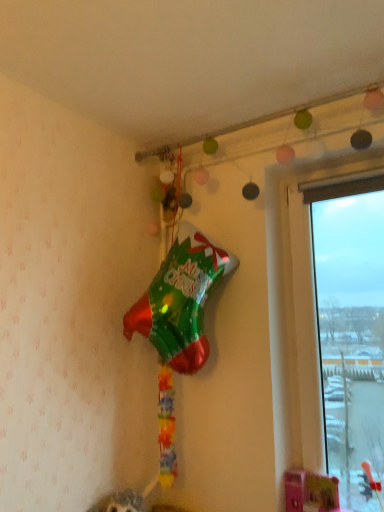
What do you see at coordinates (341, 330) in the screenshot? I see `transparent glass window at right` at bounding box center [341, 330].

The height and width of the screenshot is (512, 384). I want to click on transparent glass window at right, so click(341, 330).

In order to face transparent glass window at right, should I rotate leftwards or rightwards?

A 19.136 degree turn to the right will do.

What is the approximate width of transparent glass window at right?

It is 4.49 inches.

Find the location of a particular element. This screenshot has width=384, height=512. transparent glass window at right is located at coordinates (341, 330).